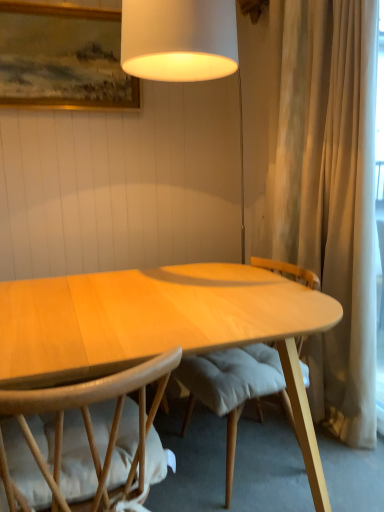
Where is `wooden framed painting at upper left`? wooden framed painting at upper left is located at coordinates [x=62, y=58].

You are a GUI agent. You are given a task and a screenshot of the screen. Output one action in this format:
    pyautogui.click(x=<x>, y=<y>)
    Task: Click on the light brown wood chair at lower left
    
    Given the screenshot: What is the action you would take?
    pyautogui.click(x=84, y=443)

Can you confirm if wooden framed painting at upper left is positioned to the right of light brown wood chair at lower left?

Incorrect, wooden framed painting at upper left is not on the right side of light brown wood chair at lower left.

From the picture: Is wooden framed painting at upper left next to light brown wood chair at lower left?

No.

You are a GUI agent. You are given a task and a screenshot of the screen. Output one action in this format:
    pyautogui.click(x=<x>, y=<y>)
    Task: Click on the picture frame above the light brown wood chair at lower left (from the image's perspective)
    The height and width of the screenshot is (512, 384).
    Given the screenshot: What is the action you would take?
    pyautogui.click(x=62, y=58)

Based on their sizes in the image, would you say wooden framed painting at upper left is bigger or smaller than light brown wood chair at lower left?

In the image, wooden framed painting at upper left appears to be smaller than light brown wood chair at lower left.

From the picture: Which object is positioned more to the left, light brown wood chair at lower left or wooden framed painting at upper left?

wooden framed painting at upper left.

Does point (145, 431) come farther from viewer compared to point (3, 84)?

That is False.

Is light brown wood chair at lower left thinner than wooden framed painting at upper left?

In fact, light brown wood chair at lower left might be wider than wooden framed painting at upper left.

This screenshot has height=512, width=384. In order to click on picture frame lying behind the light brown wood chair at lower left in this screenshot , I will do (x=62, y=58).

At what (x,y) coordinates should I click in order to perform the action: click on picture frame that appears behind the light wood desk at center. Please return your answer as a coordinate pair (x, y). Looking at the image, I should click on (62, 58).

Can you tell me how much light wood desk at center and wooden framed painting at upper left differ in facing direction?

90 degrees separate the facing orientations of light wood desk at center and wooden framed painting at upper left.

Does light wood desk at center touch wooden framed painting at upper left?

No, light wood desk at center is not with wooden framed painting at upper left.

From the image's perspective, is light wood desk at center above or below wooden framed painting at upper left?

From the image's perspective, light wood desk at center appears below wooden framed painting at upper left.

The height and width of the screenshot is (512, 384). Identify the location of chair that is in front of the light wood desk at center. (84, 443).

From the image's perspective, who appears lower, light brown wood chair at lower left or light wood desk at center?

light brown wood chair at lower left.

Is light brown wood chair at lower left to the right of light wood desk at center from the viewer's perspective?

No, light brown wood chair at lower left is not to the right of light wood desk at center.

Who is smaller, light brown wood chair at lower left or light wood desk at center?

light brown wood chair at lower left is smaller.

Would you consider light wood desk at center to be distant from light brown wood chair at lower left?

No, light wood desk at center is not far from light brown wood chair at lower left.

Between point (283, 367) and point (99, 441), which one is positioned behind?

The point (283, 367) is behind.

Is light wood desk at center looking in the opposite direction of light brown wood chair at lower left?

light wood desk at center is not turned away from light brown wood chair at lower left.

The width and height of the screenshot is (384, 512). In the image, there is a light wood desk at center. In order to click on chair below it (from the image's perspective) in this screenshot , I will do `click(84, 443)`.

Is wooden framed painting at upper left spatially inside light wood desk at center, or outside of it?

wooden framed painting at upper left is outside light wood desk at center.

From a real-world perspective, who is located lower, wooden framed painting at upper left or light wood desk at center?

light wood desk at center is physically lower.

Identify the location of desk in front of the wooden framed painting at upper left. [160, 327].

Would you say wooden framed painting at upper left is to the left or to the right of light wood desk at center in the picture?

Clearly, wooden framed painting at upper left is on the left of light wood desk at center in the image.

Identify the location of picture frame behind the light brown wood chair at lower left. (62, 58).

This screenshot has height=512, width=384. Find the location of `chair that is under the wooden framed painting at upper left (from a real-world perspective)`. chair that is under the wooden framed painting at upper left (from a real-world perspective) is located at coordinates (84, 443).

Looking at the image, which one is located further to light brown wood chair at lower left, light wood desk at center or wooden framed painting at upper left?

wooden framed painting at upper left is further to light brown wood chair at lower left.

Based on their spatial positions, is light brown wood chair at lower left or light wood desk at center closer to wooden framed painting at upper left?

Among the two, light wood desk at center is located nearer to wooden framed painting at upper left.

Consider the image. Considering their positions, is light wood desk at center positioned closer to wooden framed painting at upper left than light brown wood chair at lower left?

light wood desk at center is positioned closer to the anchor wooden framed painting at upper left.

Looking at the image, which one is located closer to light brown wood chair at lower left, wooden framed painting at upper left or light wood desk at center?

The object closer to light brown wood chair at lower left is light wood desk at center.

Looking at the image, which one is located closer to light wood desk at center, wooden framed painting at upper left or light brown wood chair at lower left?

The object closer to light wood desk at center is light brown wood chair at lower left.

From the image, which object appears to be nearer to light wood desk at center, light brown wood chair at lower left or wooden framed painting at upper left?

Among the two, light brown wood chair at lower left is located nearer to light wood desk at center.

Locate an element on the screen. Image resolution: width=384 pixels, height=512 pixels. desk between wooden framed painting at upper left and light brown wood chair at lower left in the up-down direction is located at coordinates (160, 327).